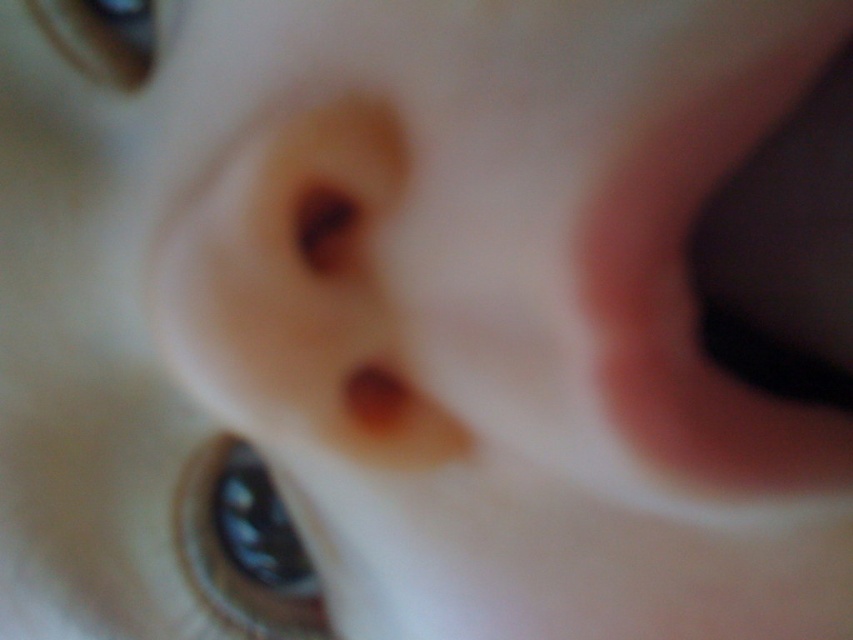
Between pink flesh-colored mouth at center and matte black eye at upper left, which one appears on the right side from the viewer's perspective?

From the viewer's perspective, pink flesh-colored mouth at center appears more on the right side.

Is pink flesh-colored mouth at center bigger than matte black eye at upper left?

Yes, pink flesh-colored mouth at center is bigger than matte black eye at upper left.

I want to click on pink flesh-colored mouth at center, so tap(691, 291).

Based on the photo, between satin black eye at center and matte black eye at upper left, which one is positioned higher?

matte black eye at upper left

Is satin black eye at center closer to camera compared to matte black eye at upper left?

No, it is behind matte black eye at upper left.

Between point (212, 557) and point (99, 19), which one is positioned behind?

Positioned behind is point (212, 557).

You are a GUI agent. You are given a task and a screenshot of the screen. Output one action in this format:
    pyautogui.click(x=<x>, y=<y>)
    Task: Click on the satin black eye at center
    The image size is (853, 640).
    Given the screenshot: What is the action you would take?
    click(x=244, y=545)

Does point (648, 300) lie in front of point (196, 584)?

Yes.

Is pink flesh-colored mouth at center wider than satin black eye at center?

Correct, the width of pink flesh-colored mouth at center exceeds that of satin black eye at center.

Is point (590, 221) in front of point (235, 444)?

Yes.

Identify the location of pink flesh-colored mouth at center. (691, 291).